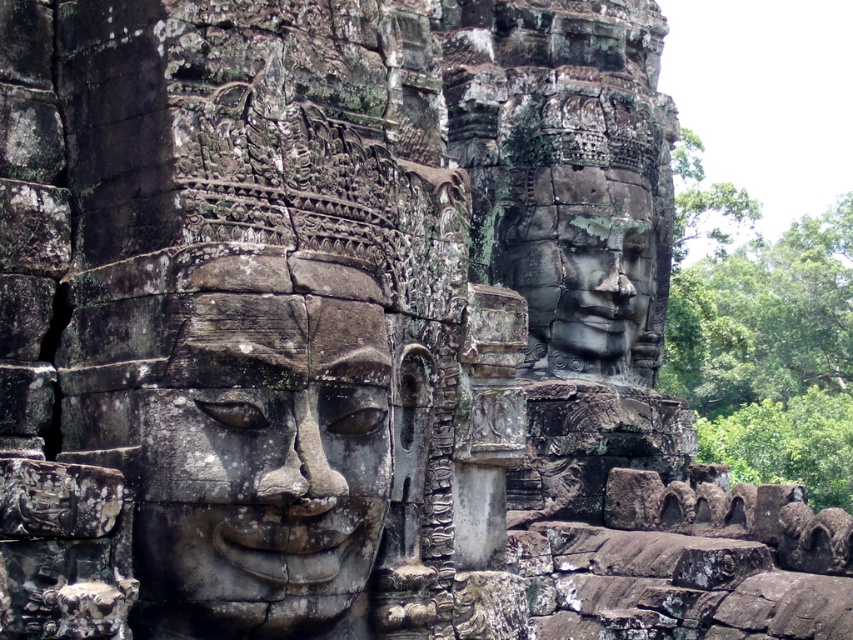
Is gray stone face at center bigger than gray stone face at upper center?

No, gray stone face at center is not bigger than gray stone face at upper center.

What do you see at coordinates (263, 449) in the screenshot? I see `gray stone face at center` at bounding box center [263, 449].

Locate an element on the screen. gray stone face at center is located at coordinates (263, 449).

At what (x,y) coordinates should I click in order to perform the action: click on gray stone face at center. Please return your answer as a coordinate pair (x, y). The width and height of the screenshot is (853, 640). Looking at the image, I should click on (263, 449).